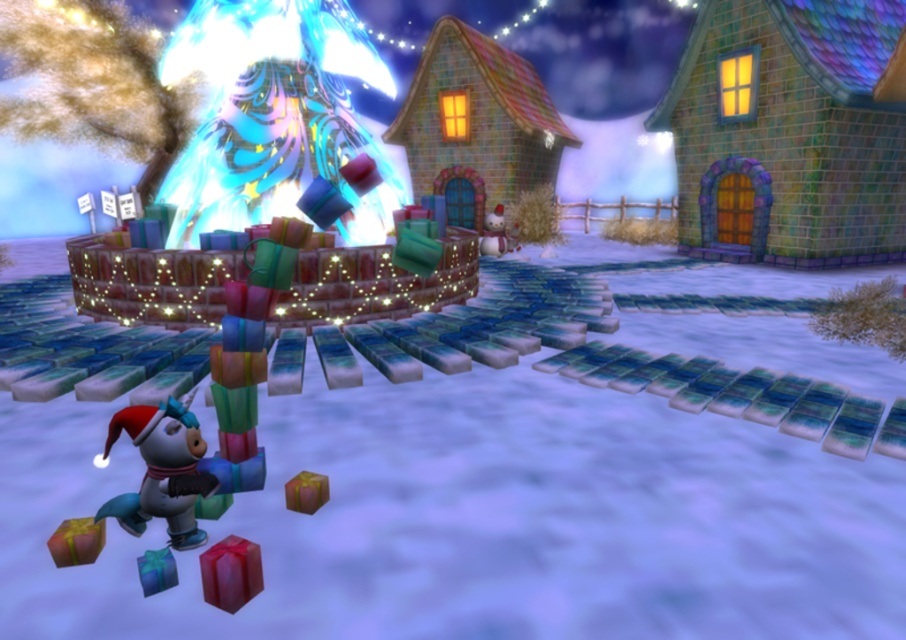
You are a character in this winter scene and you want to place a new gift exactly at the point with coordinates (479, 520). Based on the scene description, where would this gift be placed?

The point (479, 520) corresponds to the white matte snow at center, so the gift would be placed on the white matte snow at center.

You are a delivery robot in the winter scene. You need to pick up the shiny red gift at lower center and the shiny metallic gift at lower left. Which gift should you pick up first if you want to carry the heavier one?

The shiny red gift at lower center is larger than the shiny metallic gift at lower left, so it is likely heavier. You should pick up the shiny red gift at lower center first.